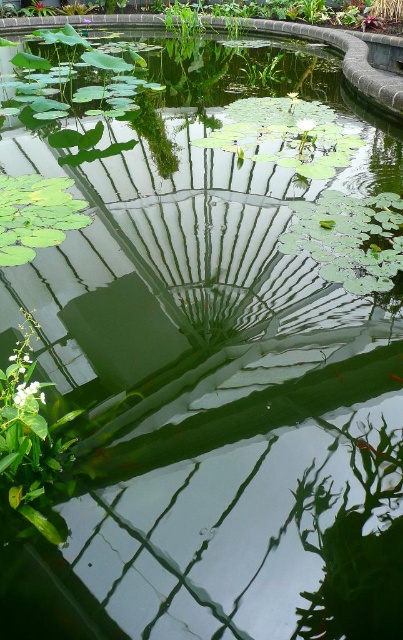
From the picture: You are standing at the edge of the pond and want to throw a pebble into the water. If you aim for the point closer to you between point [361,625] and point [35,205], which point should you target?

You should target point [361,625] because it is closer to you than point [35,205].

You are a photographer positioned at the edge of the pond. You want to capture a photo that includes both the green leafy plant at upper center and the green glossy lily pad at upper left. Based on their positions, which object should you adjust your camera to focus on first to ensure both are in the frame?

The green glossy lily pad at upper left is to the left of the green leafy plant at upper center. To include both in the frame, you should first focus on the green glossy lily pad at upper left to ensure it is positioned correctly before adjusting for the other object.

You are standing at the edge of the pond and notice both the green leafy plant at lower right and the green glossy lily pad at upper left. Which of these two objects is positioned more to the right side of the pond?

The green leafy plant at lower right is positioned to the right of the green glossy lily pad at upper left, so it is more to the right side of the pond.